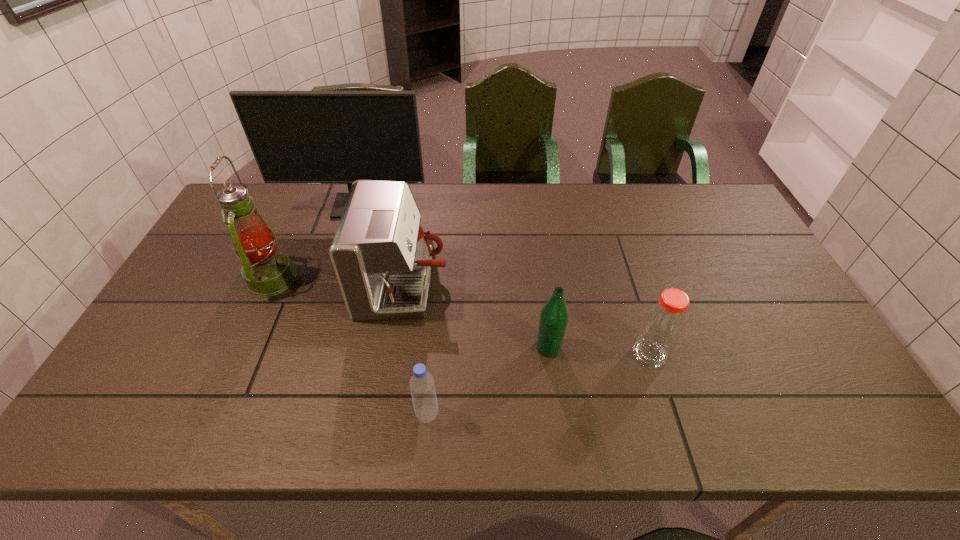
Locate an element on the screen. Image resolution: width=960 pixels, height=540 pixels. vacant space that satisfies the following two spatial constraints: 1. on the front of the fourth shortest object near the spout; 2. on the left side of the shortest object is located at coordinates (383, 414).

Locate an element on the screen. blank space that satisfies the following two spatial constraints: 1. on the front of the coffee maker near the spout; 2. on the left side of the fifth object from left to right is located at coordinates (395, 348).

At what (x,y) coordinates should I click in order to perform the action: click on vacant space that satisfies the following two spatial constraints: 1. on the front of the second bottle from right to left near the spout; 2. on the right side of the coffee maker. Please return your answer as a coordinate pair (x, y). This screenshot has height=540, width=960. Looking at the image, I should click on (395, 348).

Find the location of a particular element. free space that satisfies the following two spatial constraints: 1. on the front-facing side of the computer monitor; 2. on the right side of the rightmost object is located at coordinates (308, 354).